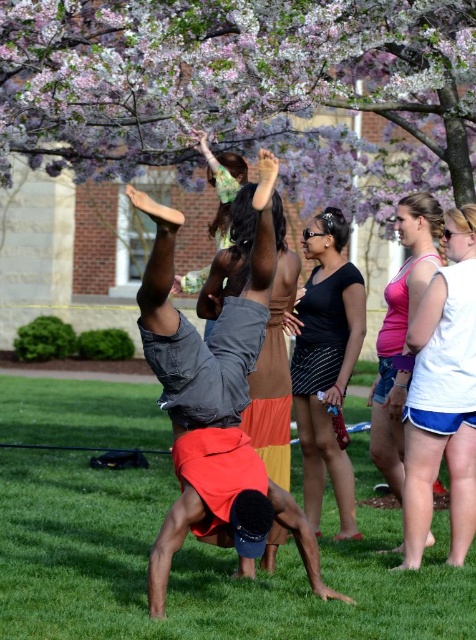
Question: Is black striped skirt at center wider than pink fabric shorts at right?

Choices:
 (A) yes
 (B) no

Answer: (A)

Question: Which of the following is the farthest from the observer?

Choices:
 (A) green grass at center
 (B) pink fabric shorts at right

Answer: (B)

Question: Is black striped skirt at center in front of pink fabric shorts at right?

Choices:
 (A) yes
 (B) no

Answer: (B)

Question: Which point appears farthest from the camera in this image?

Choices:
 (A) (171, 243)
 (B) (402, 609)

Answer: (B)

Question: Does green grass at center have a smaller size compared to denim shorts at center?

Choices:
 (A) yes
 (B) no

Answer: (B)

Question: Which point is farther to the camera?

Choices:
 (A) (192, 65)
 (B) (75, 474)
 (C) (144, 333)
 (D) (304, 508)

Answer: (B)